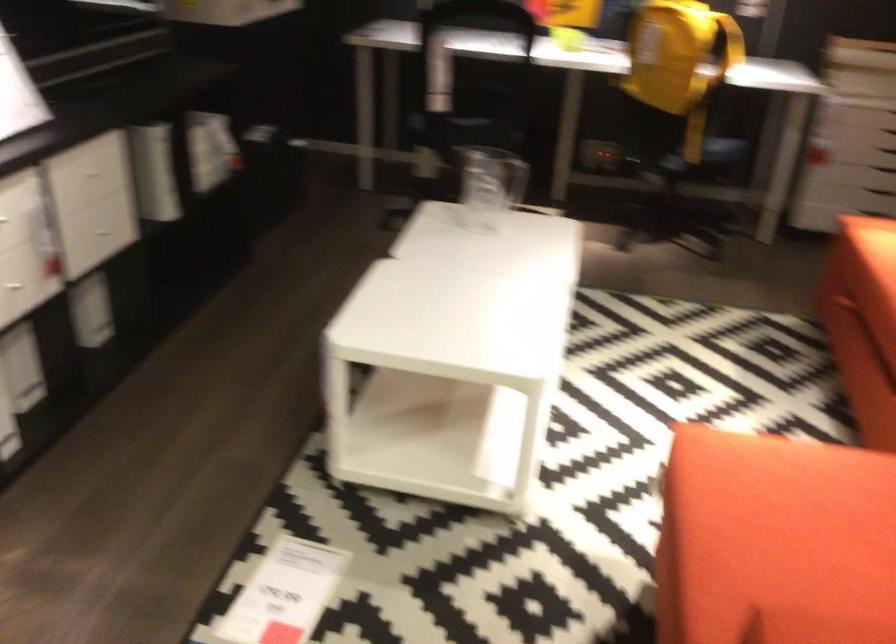
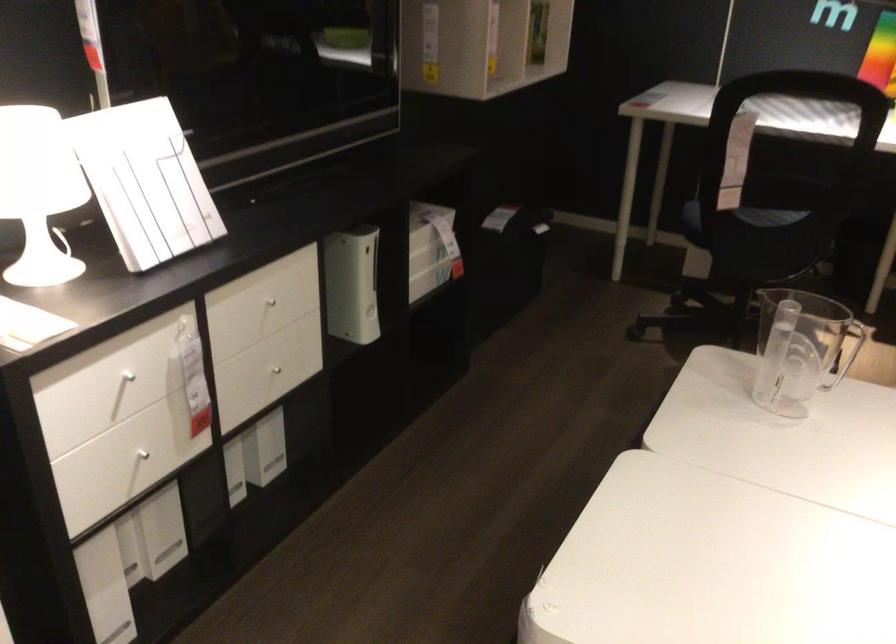
Find the pixel in the second image that matches point (270, 172) in the first image.

(507, 263)